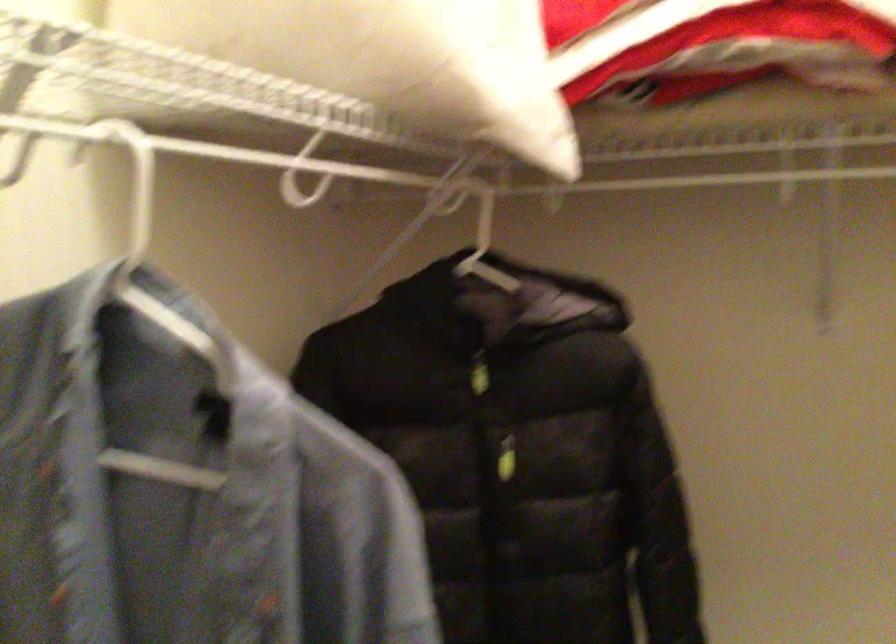
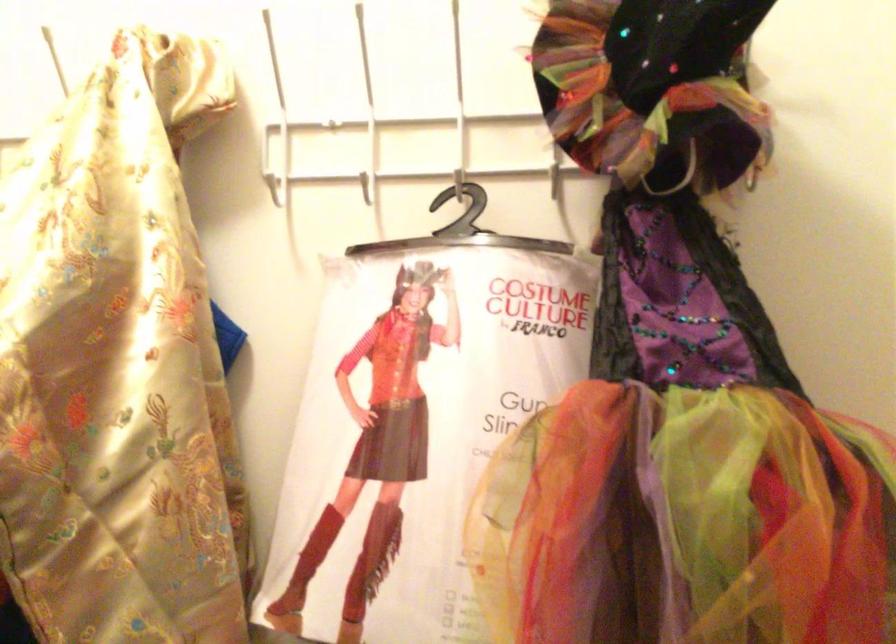
Question: The first image is from the beginning of the video and the second image is from the end. How did the camera likely rotate when shooting the video?

Choices:
 (A) Left
 (B) Right
 (C) Up
 (D) Down

Answer: (B)